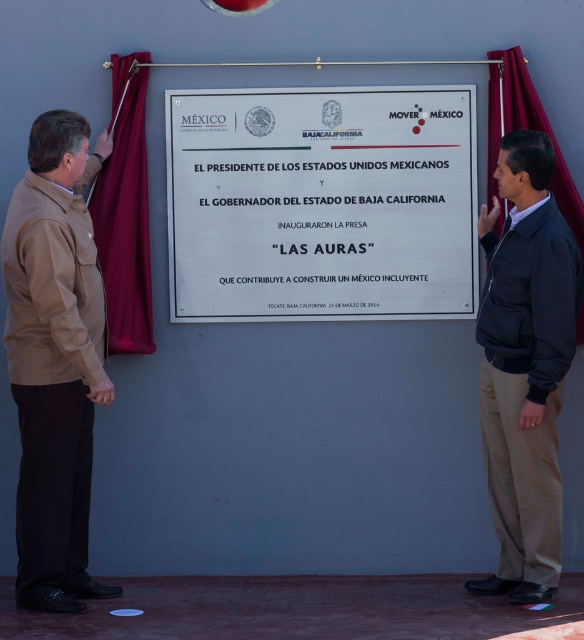
You are a photographer positioned in front of the white metallic plaque at center and the dark blue jacket at right. You want to capture both objects in a single frame. Which object should you position closer to the edge of the frame to ensure both are fully visible?

To ensure both the white metallic plaque at center and the dark blue jacket at right are fully visible in the frame, you should position the dark blue jacket at right closer to the edge since the white metallic plaque at center might be wider than the dark blue jacket at right.

What are the coordinates of the tan fabric jacket at left?

The tan fabric jacket at left is located at coordinates point (54, 358).

You are a photographer at the inauguration ceremony of the dam. You need to capture a photo of both the tan fabric jacket at left and the dark blue jacket at right. Which jacket is positioned to the left of the other in the scene?

The tan fabric jacket at left is to the left of the dark blue jacket at right, so the tan fabric jacket at left is positioned to the left of the dark blue jacket at right in the scene.